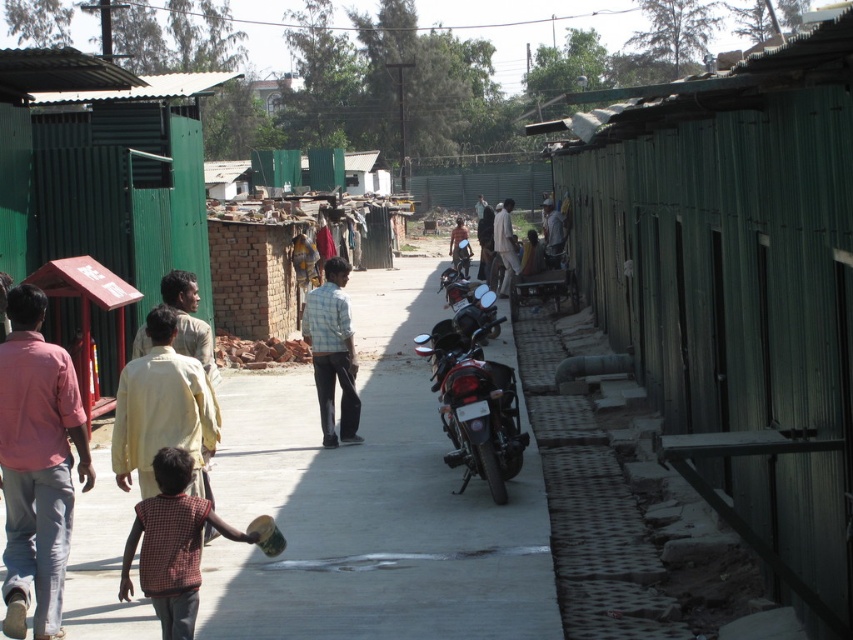
You are standing at the center of the pathway and want to reach both the point at coordinates (115,436) and the point at coordinates (508,228). Which point should you reach first to minimize your walking distance?

You should reach point (115,436) first because it is closer to you than point (508,228).

What is the exact coordinate of the gray concrete pavement at center?

The gray concrete pavement at center is located at point (370, 502).